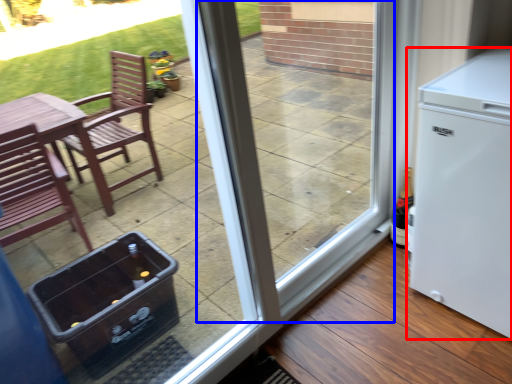
Question: Among these objects, which one is nearest to the camera, refrigerator (highlighted by a red box) or screen door (highlighted by a blue box)?

Choices:
 (A) refrigerator
 (B) screen door

Answer: (B)